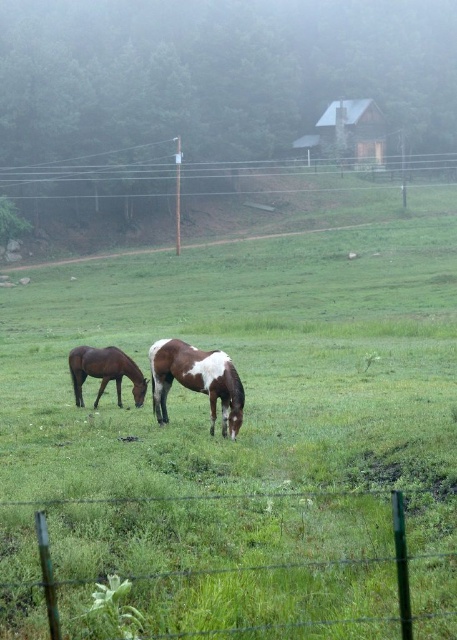
Between brown glossy horse at center and brown glossy horse at left, which one has more height?

brown glossy horse at center is taller.

Is point (207, 378) positioned before point (100, 381)?

That is True.

Does point (206, 369) come farther from viewer compared to point (72, 348)?

That is False.

Where is `brown glossy horse at center`? This screenshot has width=457, height=640. brown glossy horse at center is located at coordinates (196, 380).

Is green wire fence at lower center thinner than brown glossy horse at left?

Indeed, green wire fence at lower center has a lesser width compared to brown glossy horse at left.

How far apart are green wire fence at lower center and brown glossy horse at left?

green wire fence at lower center is 8.31 meters from brown glossy horse at left.

You are a GUI agent. You are given a task and a screenshot of the screen. Output one action in this format:
    pyautogui.click(x=<x>, y=<y>)
    Task: Click on the green wire fence at lower center
    
    Given the screenshot: What is the action you would take?
    pyautogui.click(x=339, y=564)

Does green wire fence at lower center come in front of brown glossy horse at center?

Yes, it is in front of brown glossy horse at center.

Is point (53, 502) farther from camera compared to point (196, 392)?

No, (53, 502) is closer to viewer.

I want to click on green wire fence at lower center, so click(339, 564).